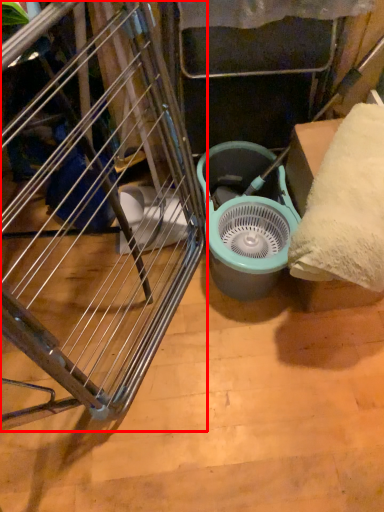
Question: Observing the image, what is the correct spatial positioning of furniture (annotated by the red box) in reference to mechanical fan?

Choices:
 (A) right
 (B) left

Answer: (B)